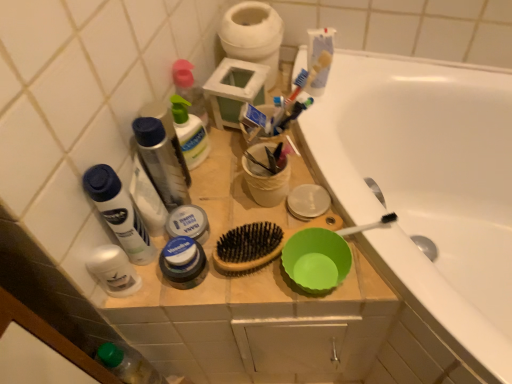
Identify the location of vacant space behind matte blue jar at center, acting as the second toiletry starting from the bottom. (217, 190).